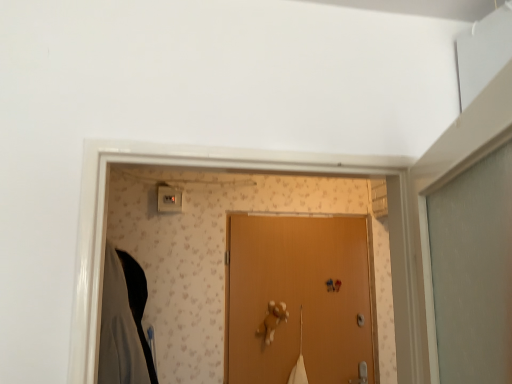
Question: Considering the relative positions of white plastic light switch at upper center and black matte robe at left in the image provided, is white plastic light switch at upper center to the right of black matte robe at left from the viewer's perspective?

Choices:
 (A) no
 (B) yes

Answer: (B)

Question: Is white plastic light switch at upper center thinner than black matte robe at left?

Choices:
 (A) no
 (B) yes

Answer: (B)

Question: Can you confirm if white plastic light switch at upper center is shorter than black matte robe at left?

Choices:
 (A) yes
 (B) no

Answer: (A)

Question: Is white plastic light switch at upper center positioned before black matte robe at left?

Choices:
 (A) yes
 (B) no

Answer: (B)

Question: From the image's perspective, is white plastic light switch at upper center located beneath black matte robe at left?

Choices:
 (A) yes
 (B) no

Answer: (B)

Question: Is black matte robe at left completely or partially inside white plastic light switch at upper center?

Choices:
 (A) yes
 (B) no

Answer: (B)

Question: Considering the relative positions of black matte robe at left and white plastic light switch at upper center in the image provided, is black matte robe at left to the left of white plastic light switch at upper center from the viewer's perspective?

Choices:
 (A) no
 (B) yes

Answer: (B)

Question: Considering the relative sizes of black matte robe at left and white plastic light switch at upper center in the image provided, is black matte robe at left shorter than white plastic light switch at upper center?

Choices:
 (A) no
 (B) yes

Answer: (A)

Question: Considering the relative sizes of black matte robe at left and white plastic light switch at upper center in the image provided, is black matte robe at left taller than white plastic light switch at upper center?

Choices:
 (A) no
 (B) yes

Answer: (B)

Question: Is black matte robe at left turned away from white plastic light switch at upper center?

Choices:
 (A) no
 (B) yes

Answer: (A)

Question: Is black matte robe at left facing towards white plastic light switch at upper center?

Choices:
 (A) yes
 (B) no

Answer: (B)

Question: From the image's perspective, is black matte robe at left above white plastic light switch at upper center?

Choices:
 (A) no
 (B) yes

Answer: (A)

Question: Considering the relative sizes of wooden door at center and black matte robe at left in the image provided, is wooden door at center wider than black matte robe at left?

Choices:
 (A) no
 (B) yes

Answer: (A)